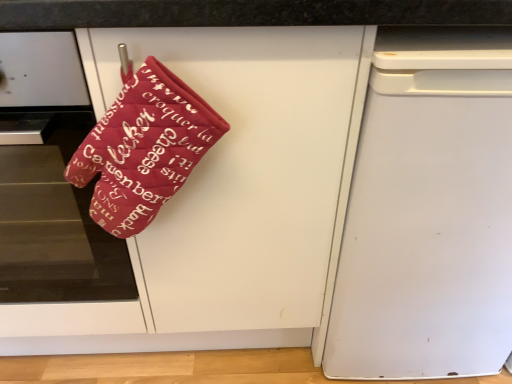
Question: Should I look upward or downward to see white matte dishwasher at right?

Choices:
 (A) down
 (B) up

Answer: (B)

Question: Is velvet red oven mitt at left at the back of white matte dishwasher at right?

Choices:
 (A) no
 (B) yes

Answer: (A)

Question: From a real-world perspective, is white matte dishwasher at right under velvet red oven mitt at left?

Choices:
 (A) yes
 (B) no

Answer: (A)

Question: Is white matte dishwasher at right located outside velvet red oven mitt at left?

Choices:
 (A) yes
 (B) no

Answer: (A)

Question: Would you say white matte dishwasher at right is a long distance from velvet red oven mitt at left?

Choices:
 (A) no
 (B) yes

Answer: (A)

Question: Considering the relative sizes of white matte dishwasher at right and velvet red oven mitt at left in the image provided, is white matte dishwasher at right bigger than velvet red oven mitt at left?

Choices:
 (A) no
 (B) yes

Answer: (B)

Question: Considering the relative sizes of white matte dishwasher at right and velvet red oven mitt at left in the image provided, is white matte dishwasher at right thinner than velvet red oven mitt at left?

Choices:
 (A) no
 (B) yes

Answer: (A)

Question: Is matte red oven mitt at upper left surrounding velvet red oven mitt at left?

Choices:
 (A) no
 (B) yes

Answer: (B)

Question: Is matte red oven mitt at upper left facing away from velvet red oven mitt at left?

Choices:
 (A) yes
 (B) no

Answer: (A)

Question: Can you confirm if matte red oven mitt at upper left is taller than velvet red oven mitt at left?

Choices:
 (A) yes
 (B) no

Answer: (A)

Question: From a real-world perspective, is matte red oven mitt at upper left positioned over velvet red oven mitt at left based on gravity?

Choices:
 (A) yes
 (B) no

Answer: (B)

Question: Considering the relative sizes of matte red oven mitt at upper left and velvet red oven mitt at left in the image provided, is matte red oven mitt at upper left wider than velvet red oven mitt at left?

Choices:
 (A) yes
 (B) no

Answer: (A)

Question: Can you confirm if matte red oven mitt at upper left is positioned to the right of velvet red oven mitt at left?

Choices:
 (A) yes
 (B) no

Answer: (A)

Question: Does velvet red oven mitt at left have a greater height compared to matte red oven mitt at upper left?

Choices:
 (A) no
 (B) yes

Answer: (A)